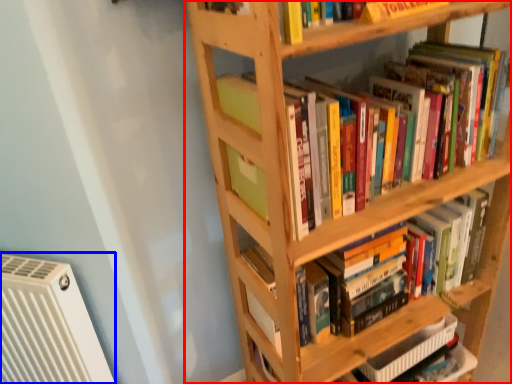
Question: Which of the following is the closest to the observer, shelf (highlighted by a red box) or air conditioning (highlighted by a blue box)?

Choices:
 (A) shelf
 (B) air conditioning

Answer: (A)